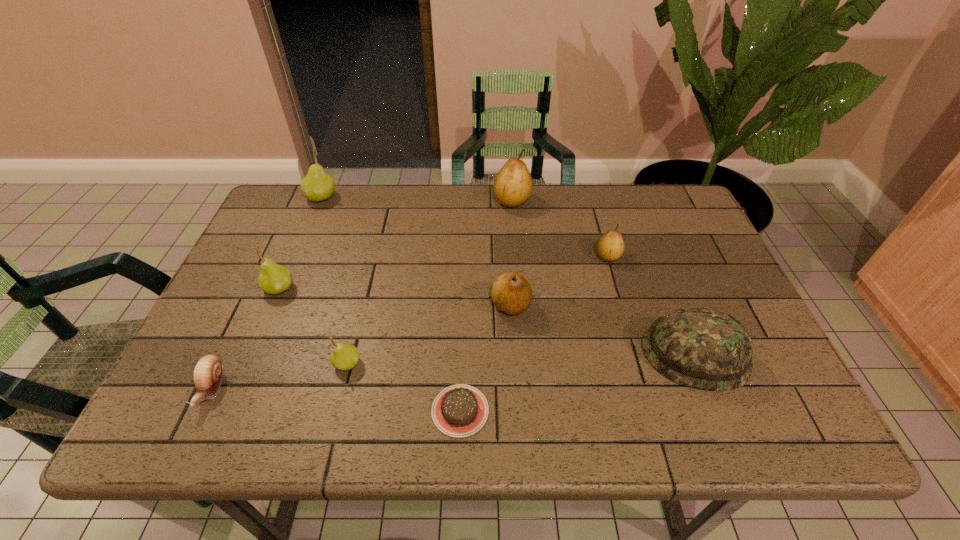
The height and width of the screenshot is (540, 960). Identify the location of the farthest brown pear. (513, 184).

Where is `the farthest green pear`? The image size is (960, 540). the farthest green pear is located at coordinates (317, 185).

You are a GUI agent. You are given a task and a screenshot of the screen. Output one action in this format:
    pyautogui.click(x=<x>, y=<y>)
    Task: Click on the second biggest green pear
    
    Given the screenshot: What is the action you would take?
    pyautogui.click(x=273, y=279)

The image size is (960, 540). I want to click on the nearest brown pear, so click(x=511, y=293).

Where is `headwear`? The height and width of the screenshot is (540, 960). headwear is located at coordinates (698, 347).

What are the coordinates of `the rightmost brown pear` in the screenshot? It's located at (610, 246).

Where is `the third farthest object`? The width and height of the screenshot is (960, 540). the third farthest object is located at coordinates (610, 246).

Locate an element on the screen. the third pear from left to right is located at coordinates (x=344, y=357).

I want to click on the fourth object from left to right, so click(344, 357).

Identify the location of escargot. (208, 373).